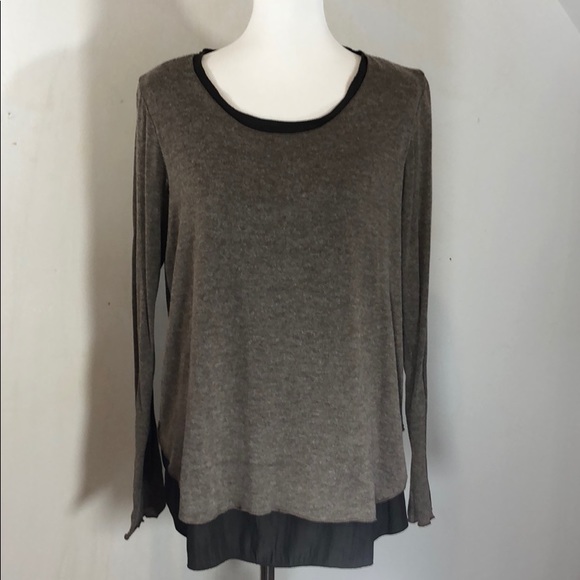
You are a GUI agent. You are given a task and a screenshot of the screen. Output one action in this format:
    pyautogui.click(x=<x>, y=<y>)
    Task: Click on the mannequin's neck
    This screenshot has height=580, width=580.
    Given the screenshot: What is the action you would take?
    coord(287,50)